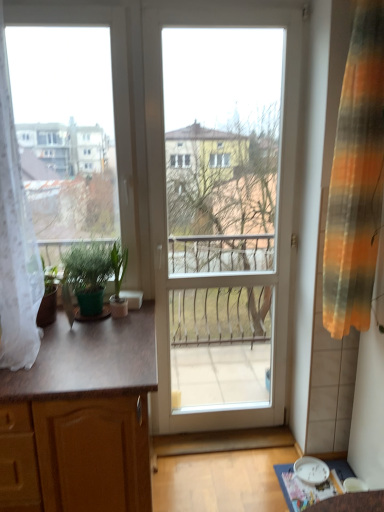
Find the location of a particular element. free region under white glossy door at center (from a real-world perspective) is located at coordinates (226, 429).